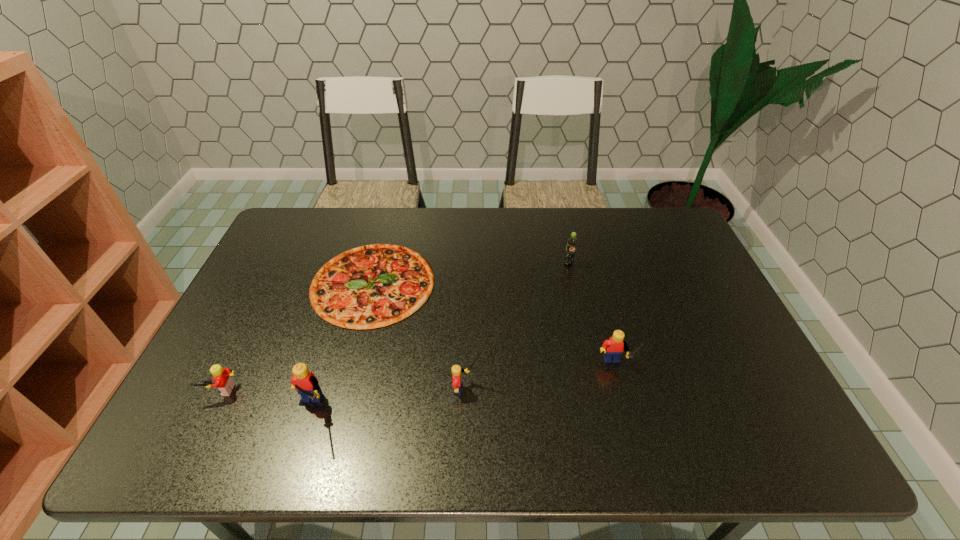
Please point a free position for a Lego on the right. Please provide its 2D coordinates. Your answer should be formatted as a tuple, i.e. [(x, y)], where the tuple contains the x and y coordinates of a point satisfying the conditions above.

[(750, 350)]